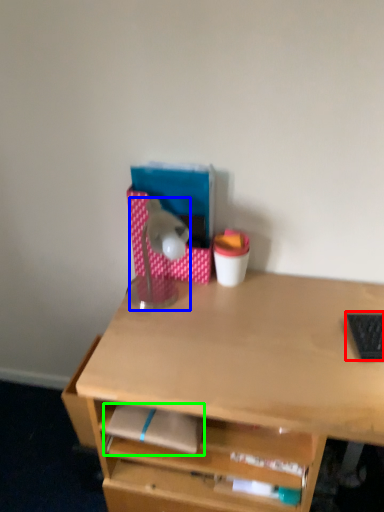
Question: Which object is positioned closest to laptop keyboard (highlighted by a red box)? Select from lamp (highlighted by a blue box) and notepad (highlighted by a green box).

Choices:
 (A) lamp
 (B) notepad

Answer: (B)